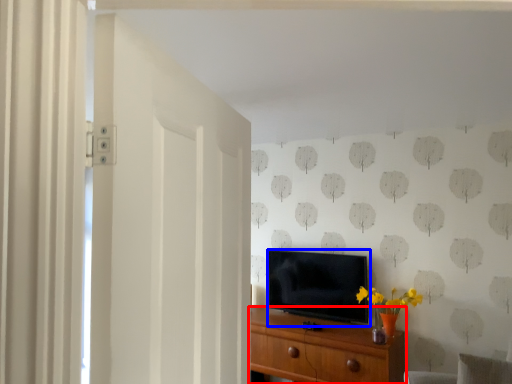
Question: Which of the following is the farthest to the observer, chest of drawers (highlighted by a red box) or television (highlighted by a blue box)?

Choices:
 (A) chest of drawers
 (B) television

Answer: (B)